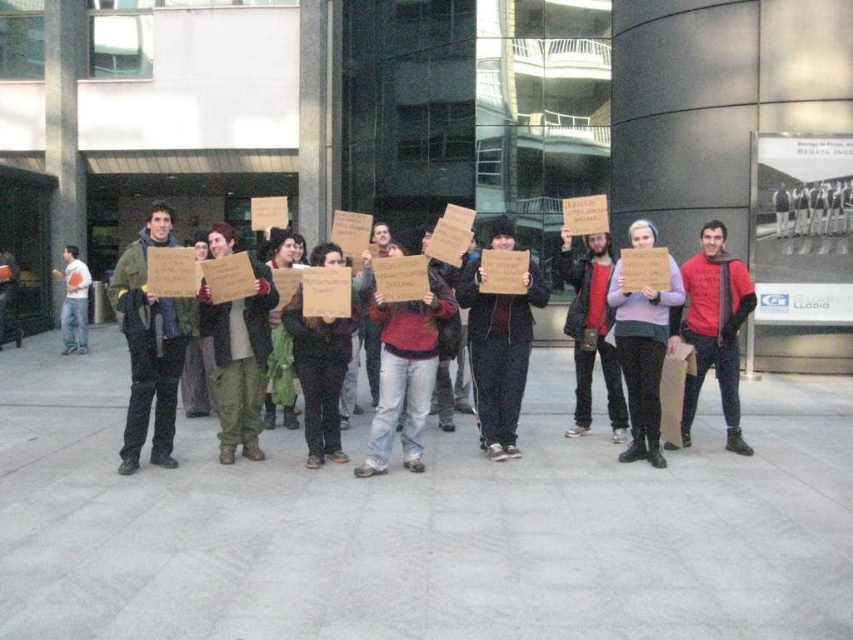
You are a photographer standing in front of the modern building and want to take a photo that includes both the point at coordinates point (128, 262) and point (337, 385). Which point should you focus on first to ensure both are in focus?

You should focus on point (128, 262) first because it is closer to the viewer than point (337, 385), ensuring both points are within the depth of field.

You are a photographer trying to capture a closeup of the red matte scarf at center and camouflage pants at center. Since the camera can only focus on one object at a time, which object should you choose to ensure the entire width of the object fits in the frame?

The red matte scarf at center has a larger width than the camouflage pants at center. Therefore, to ensure the entire width of the object fits in the frame, you should focus on the camouflage pants at center since it is narrower.